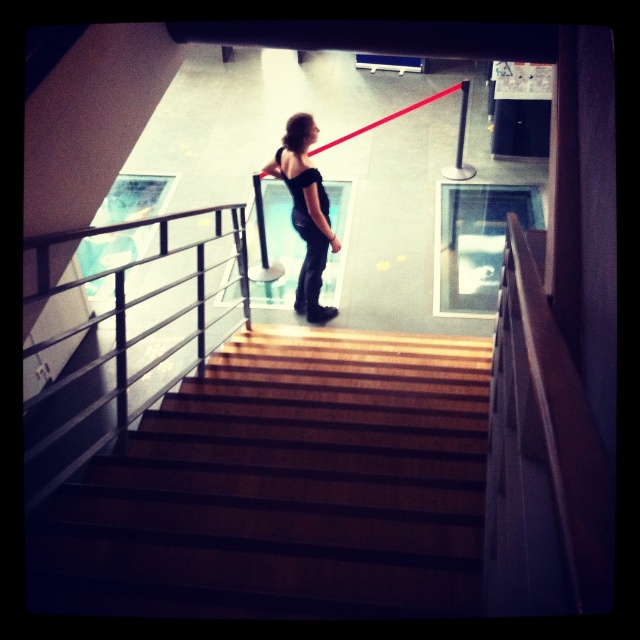
Question: Which point is closer to the camera?

Choices:
 (A) (301, 483)
 (B) (314, 205)

Answer: (A)

Question: Based on their relative distances, which object is nearer to the black leather dress at center?

Choices:
 (A) wooden stairs at center
 (B) metallic silver balustrade at center

Answer: (B)

Question: Does wooden stairs at center appear over black leather dress at center?

Choices:
 (A) yes
 (B) no

Answer: (B)

Question: Is metallic silver balustrade at center to the right of black leather dress at center from the viewer's perspective?

Choices:
 (A) yes
 (B) no

Answer: (B)

Question: Which is farther from the wooden stairs at center?

Choices:
 (A) black leather dress at center
 (B) metallic silver balustrade at center

Answer: (A)

Question: Does wooden stairs at center lie behind metallic silver balustrade at center?

Choices:
 (A) no
 (B) yes

Answer: (A)